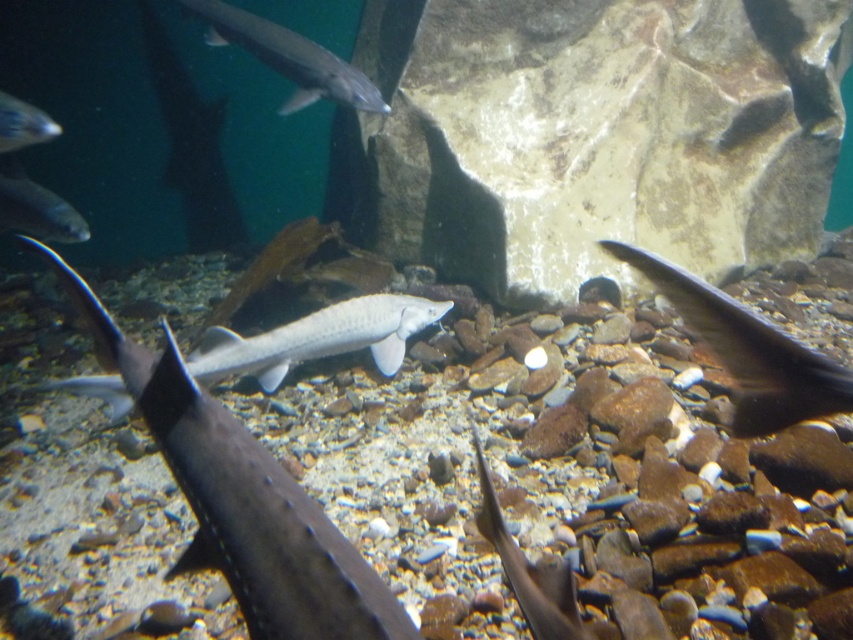
Based on the photo, you are an underwater photographer aiming to capture both the shiny black fish at center and the matte gray fish at upper left in a single frame. Given their positions and sizes, which fish will appear larger in your photo?

The shiny black fish at center will appear larger in the photo because it is taller than the matte gray fish at upper left.

You are an underwater photographer aiming to capture the smooth gray fish at center. Based on its coordinates, where should you position your camera to ensure it is centered in your shot?

The smooth gray fish at center is located at coordinates point (242,499), so you should position your camera directly facing those coordinates to center the fish in your shot.